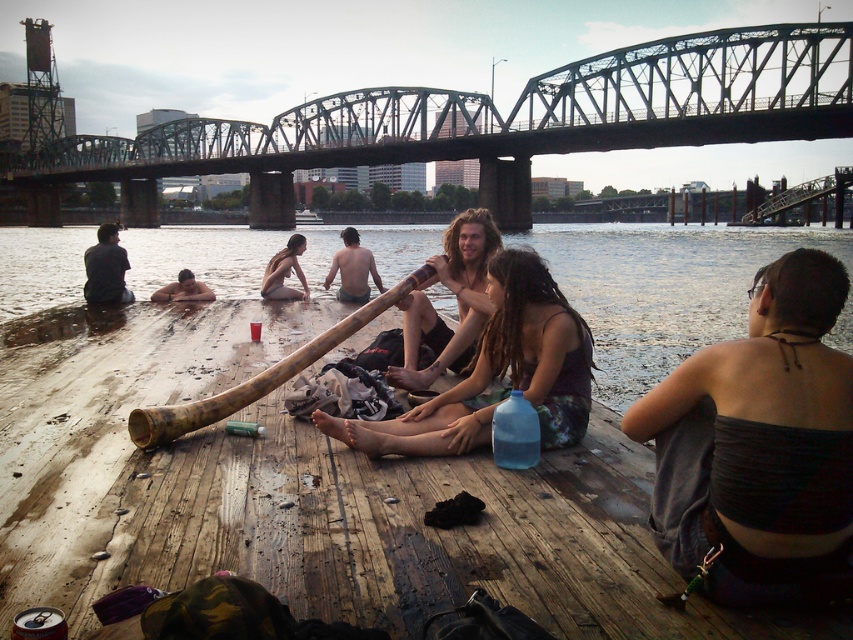
Question: Which point is closer to the camera?

Choices:
 (A) (107, 259)
 (B) (680, 58)

Answer: (A)

Question: Which of the following is the closest to the observer?

Choices:
 (A) black fabric top at right
 (B) wooden dock at center
 (C) green steel bridge at upper center

Answer: (B)

Question: Is brown wooden dock at lower center wider than natural wood dhow at center?

Choices:
 (A) no
 (B) yes

Answer: (B)

Question: Does light skin tone wood at center appear on the right side of brown leather surfboard at lower left?

Choices:
 (A) yes
 (B) no

Answer: (A)

Question: Can you confirm if wooden dock at center is positioned above dark blue shirt at left?

Choices:
 (A) no
 (B) yes

Answer: (A)

Question: Which object is positioned farthest from the dark blue shirt at left?

Choices:
 (A) wooden dock at center
 (B) wooden flute at center
 (C) black fabric top at right
 (D) brown wooden dock at lower center

Answer: (D)